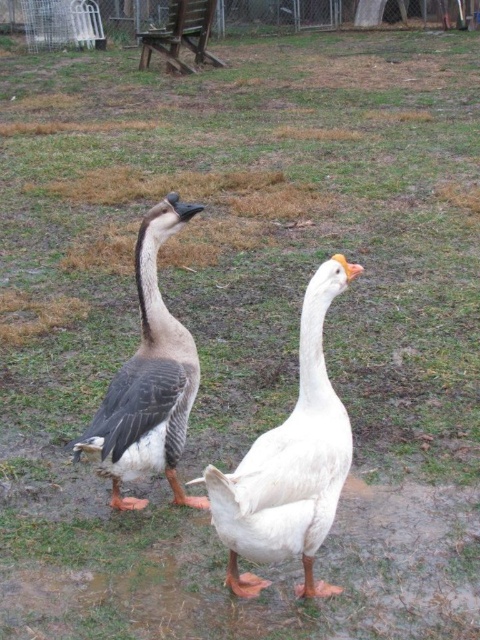
Question: Can you confirm if white matte goose at center is positioned above gray-feathered goose at center?

Choices:
 (A) yes
 (B) no

Answer: (B)

Question: Which point is closer to the camera taking this photo?

Choices:
 (A) (132, 412)
 (B) (298, 547)

Answer: (B)

Question: Is white matte goose at center above gray-feathered goose at center?

Choices:
 (A) yes
 (B) no

Answer: (B)

Question: Can you confirm if white matte goose at center is positioned above gray-feathered goose at center?

Choices:
 (A) yes
 (B) no

Answer: (B)

Question: Which point is closer to the camera taking this photo?

Choices:
 (A) (266, 445)
 (B) (79, 449)

Answer: (A)